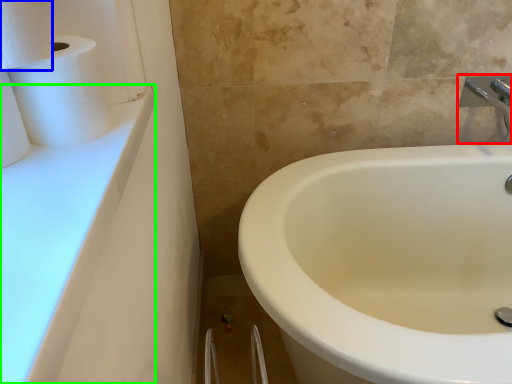
Question: Which object is positioned closest to tap (highlighted by a red box)? Select from toilet paper (highlighted by a blue box) and counter top (highlighted by a green box).

Choices:
 (A) toilet paper
 (B) counter top

Answer: (B)